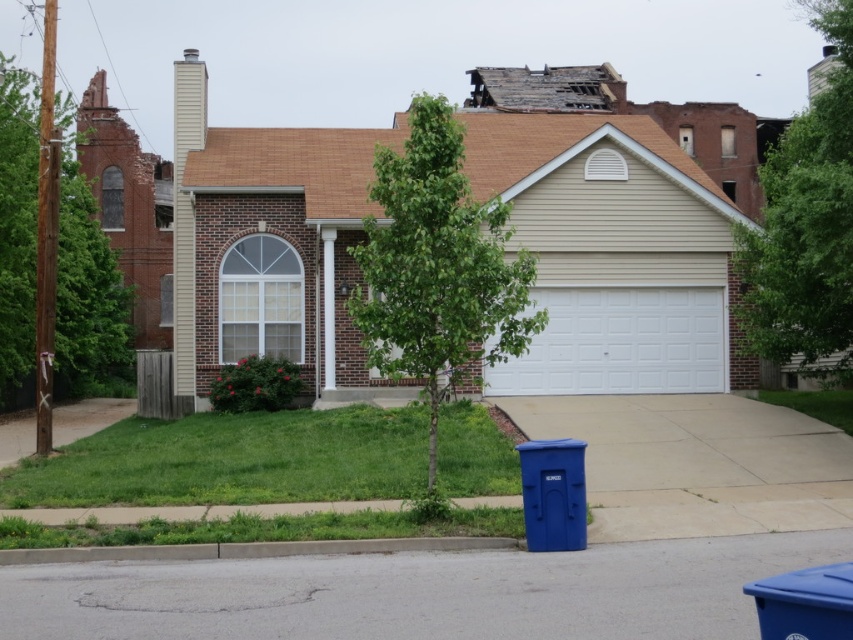
Question: Among these points, which one is farthest from the camera?

Choices:
 (A) (16, 67)
 (B) (508, 317)

Answer: (A)

Question: Is green leafy tree at upper right above gray concrete driveway at lower left?

Choices:
 (A) no
 (B) yes

Answer: (B)

Question: Is white painted wood garage door at center below green leafy tree at upper right?

Choices:
 (A) yes
 (B) no

Answer: (A)

Question: Which of the following is the closest to the observer?

Choices:
 (A) brown brick wall at left
 (B) green leafy tree at center

Answer: (B)

Question: Which of the following is the closest to the observer?

Choices:
 (A) gray concrete curb at lower center
 (B) white painted wood garage door at center
 (C) white textured garage door at center
 (D) green leafy tree at upper right

Answer: (A)

Question: Is gray concrete curb at lower center positioned before gray concrete driveway at lower left?

Choices:
 (A) no
 (B) yes

Answer: (B)